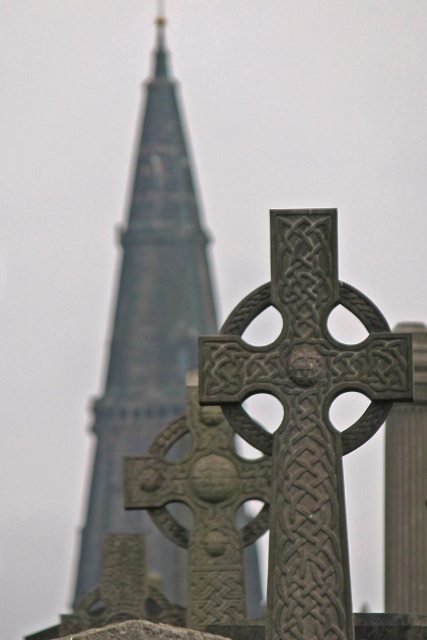
Which is behind, point (309, 326) or point (148, 451)?

Positioned behind is point (148, 451).

What do you see at coordinates (306, 413) in the screenshot? I see `dark gray stone cross at center` at bounding box center [306, 413].

At what (x,y) coordinates should I click in order to perform the action: click on dark gray stone cross at center. Please return your answer as a coordinate pair (x, y). The image size is (427, 640). Looking at the image, I should click on (306, 413).

Where is `dark gray stone cross at center`? dark gray stone cross at center is located at coordinates (306, 413).

Does point (166, 96) lie behind point (260, 467)?

Yes.

Between gray stone tower at upper left and carved stone cross at center, which one appears on the left side from the viewer's perspective?

gray stone tower at upper left

What do you see at coordinates (149, 326) in the screenshot? I see `gray stone tower at upper left` at bounding box center [149, 326].

Identify the location of gray stone tower at upper left. This screenshot has width=427, height=640. (149, 326).

Who is taller, dark gray stone cross at center or gray stone tower at upper left?

gray stone tower at upper left is taller.

In the scene shown: Is dark gray stone cross at center above gray stone tower at upper left?

No, dark gray stone cross at center is not above gray stone tower at upper left.

Describe the element at coordinates (306, 413) in the screenshot. This screenshot has height=640, width=427. I see `dark gray stone cross at center` at that location.

This screenshot has height=640, width=427. Find the location of `dark gray stone cross at center`. dark gray stone cross at center is located at coordinates (306, 413).